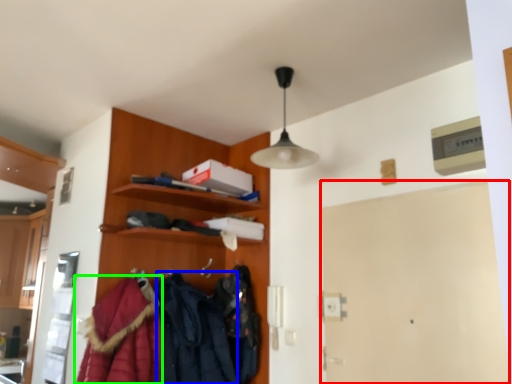
Question: Which object is positioned closest to door (highlighted by a red box)? Select from clothing (highlighted by a blue box) and cloak (highlighted by a green box).

Choices:
 (A) clothing
 (B) cloak

Answer: (A)